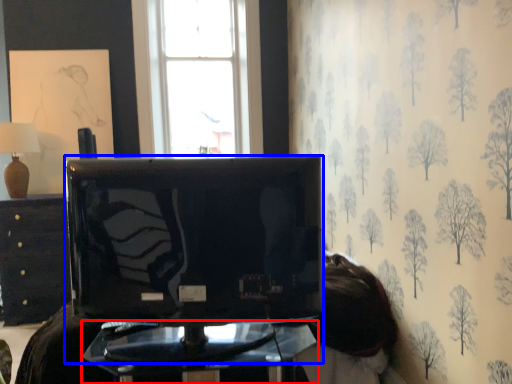
Question: Which of the following is the farthest to the observer, furniture (highlighted by a red box) or television (highlighted by a blue box)?

Choices:
 (A) furniture
 (B) television

Answer: (A)